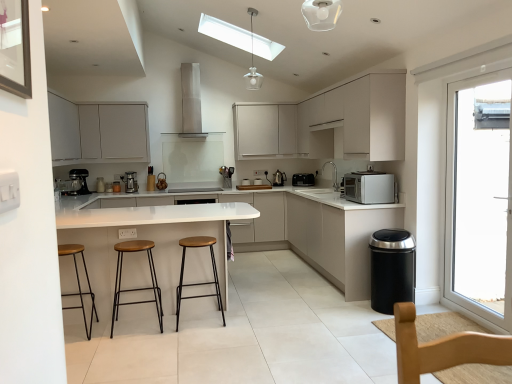
Question: From a real-world perspective, is wooden seat stool at center, the first stool when ordered from right to left, positioned over white matte cabinet at upper center, marked as the fourth cabinetry in a left-to-right arrangement, based on gravity?

Choices:
 (A) no
 (B) yes

Answer: (A)

Question: From the image's perspective, would you say wooden seat stool at center, the first stool when ordered from right to left, is shown under white matte cabinet at upper center, the second cabinetry from the right?

Choices:
 (A) yes
 (B) no

Answer: (A)

Question: Considering the relative sizes of wooden seat stool at center, arranged as the 3th stool when viewed from the left, and white matte cabinet at upper center, marked as the fourth cabinetry in a left-to-right arrangement, in the image provided, is wooden seat stool at center, arranged as the 3th stool when viewed from the left, taller than white matte cabinet at upper center, marked as the fourth cabinetry in a left-to-right arrangement,?

Choices:
 (A) no
 (B) yes

Answer: (A)

Question: Is wooden seat stool at center, the first stool when ordered from right to left, positioned far away from white matte cabinet at upper center, the second cabinetry from the right?

Choices:
 (A) yes
 (B) no

Answer: (A)

Question: Is wooden seat stool at center, arranged as the 3th stool when viewed from the left, shorter than white matte cabinet at upper center, marked as the fourth cabinetry in a left-to-right arrangement?

Choices:
 (A) yes
 (B) no

Answer: (A)

Question: Is wooden seat stool at center, arranged as the 3th stool when viewed from the left, wider than white matte cabinet at upper center, marked as the fourth cabinetry in a left-to-right arrangement?

Choices:
 (A) no
 (B) yes

Answer: (A)

Question: Can you confirm if matte white cabinet at upper left, positioned as the 5th cabinetry in right-to-left order, is smaller than matte white cabinet at upper center, the 3th cabinetry from the right?

Choices:
 (A) yes
 (B) no

Answer: (A)

Question: Is matte white cabinet at upper left, arranged as the 1th cabinetry when viewed from the left, next to matte white cabinet at upper center, the 3th cabinetry from the right, and touching it?

Choices:
 (A) yes
 (B) no

Answer: (B)

Question: Is there a large distance between matte white cabinet at upper left, positioned as the 5th cabinetry in right-to-left order, and matte white cabinet at upper center, the 3th cabinetry from the right?

Choices:
 (A) no
 (B) yes

Answer: (B)

Question: From the image's perspective, is matte white cabinet at upper left, positioned as the 5th cabinetry in right-to-left order, beneath matte white cabinet at upper center, which appears as the 3th cabinetry when viewed from the left?

Choices:
 (A) no
 (B) yes

Answer: (B)

Question: Would you say matte white cabinet at upper center, the 3th cabinetry from the right, is part of matte white cabinet at upper left, positioned as the 5th cabinetry in right-to-left order,'s contents?

Choices:
 (A) yes
 (B) no

Answer: (B)

Question: Is matte white cabinet at upper left, arranged as the 1th cabinetry when viewed from the left, wider than matte white cabinet at upper center, the 3th cabinetry from the right?

Choices:
 (A) yes
 (B) no

Answer: (B)

Question: Is white matte microwave at right to the right of satin silver toaster at center, which ranks as the 2th appliance in left-to-right order, from the viewer's perspective?

Choices:
 (A) yes
 (B) no

Answer: (A)